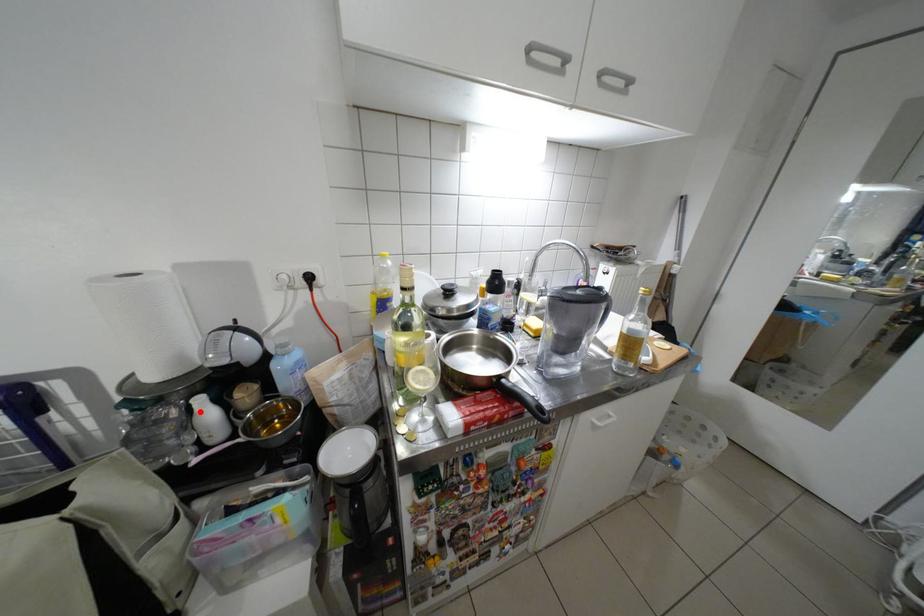
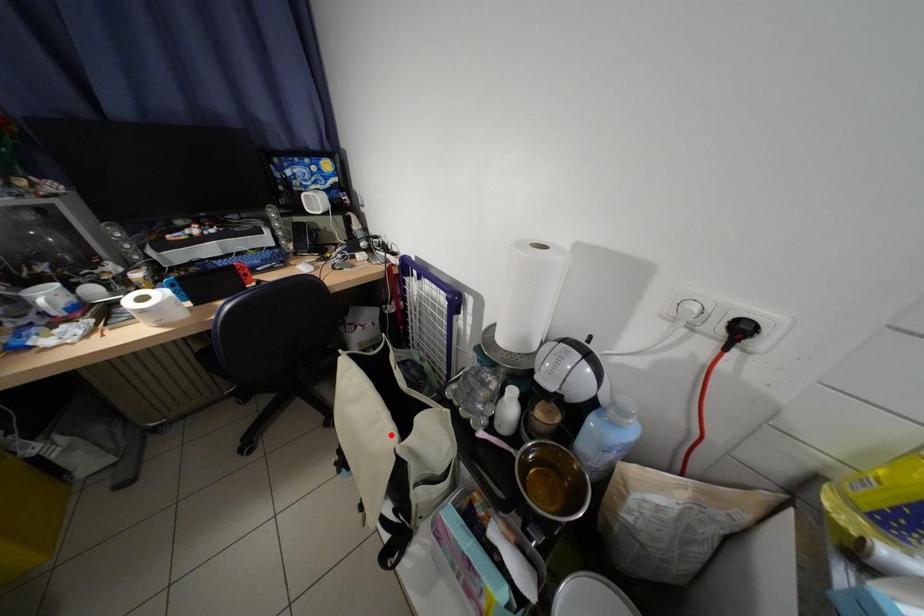
Looking at this image, I am providing you with two images of the same scene from different viewpoints. A red point is marked on the first image and another point is marked on the second image. Are the points marked in image1 and image2 representing the same 3D position?

No